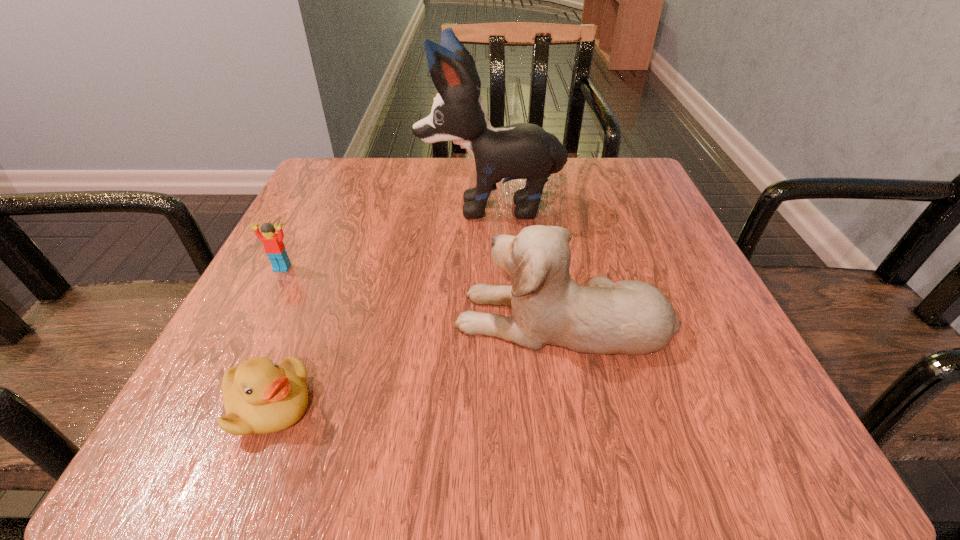
Find the location of a particular element. free spot between the second farthest object and the farther puppy is located at coordinates (387, 237).

Where is `free spot between the taller puppy and the Lego`? The image size is (960, 540). free spot between the taller puppy and the Lego is located at coordinates (387, 237).

I want to click on empty location between the Lego and the nearest object, so click(x=276, y=336).

The height and width of the screenshot is (540, 960). In order to click on vacant area between the Lego and the duckling in this screenshot , I will do `click(276, 336)`.

Identify the location of free point between the Lego and the shorter puppy. The image size is (960, 540). (423, 293).

At what (x,y) coordinates should I click in order to perform the action: click on free spot between the third nearest object and the nearer puppy. Please return your answer as a coordinate pair (x, y). This screenshot has height=540, width=960. Looking at the image, I should click on (423, 293).

Where is `object that is the second closest to the duckling`? object that is the second closest to the duckling is located at coordinates (274, 247).

In order to click on object that can be found as the second closest to the third nearest object in this screenshot , I will do `click(526, 151)`.

Find the location of a particular element. Image resolution: width=960 pixels, height=540 pixels. free point that satisfies the following two spatial constraints: 1. on the front-facing side of the taller puppy; 2. on the face of the Lego is located at coordinates (492, 268).